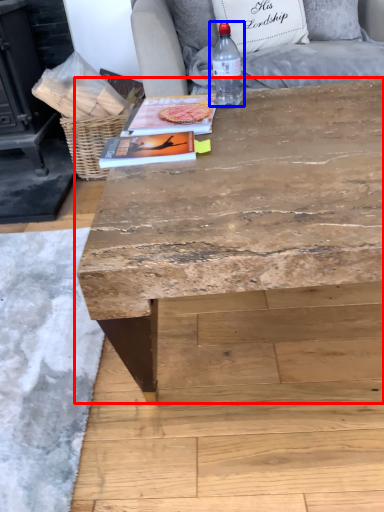
Question: Which point is closer to the camera, table (highlighted by a red box) or bottle (highlighted by a blue box)?

Choices:
 (A) table
 (B) bottle

Answer: (A)